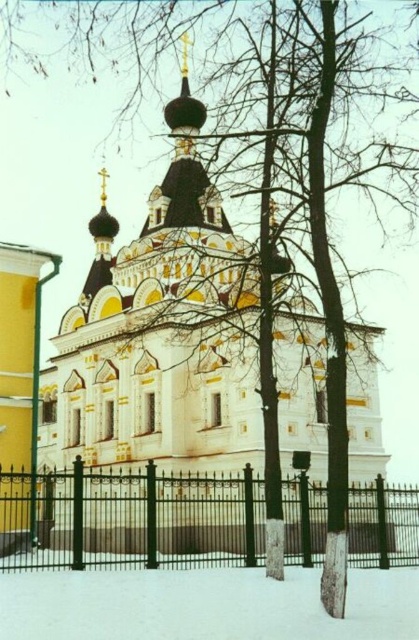
Question: Which of the following is the farthest from the observer?

Choices:
 (A) (279, 582)
 (B) (209, 513)

Answer: (B)

Question: From the image, what is the correct spatial relationship of black metal fence at lower left in relation to white powdery snow at lower center?

Choices:
 (A) below
 (B) above

Answer: (A)

Question: Which point appears farthest from the camera in this image?

Choices:
 (A) (413, 625)
 (B) (180, 476)

Answer: (B)

Question: Can you confirm if black metal fence at lower left is smaller than white powdery snow at lower center?

Choices:
 (A) no
 (B) yes

Answer: (A)

Question: From the image, what is the correct spatial relationship of black metal fence at lower left in relation to white powdery snow at lower center?

Choices:
 (A) left
 (B) right

Answer: (B)

Question: Which of the following is the closest to the observer?

Choices:
 (A) (20, 536)
 (B) (300, 592)

Answer: (B)